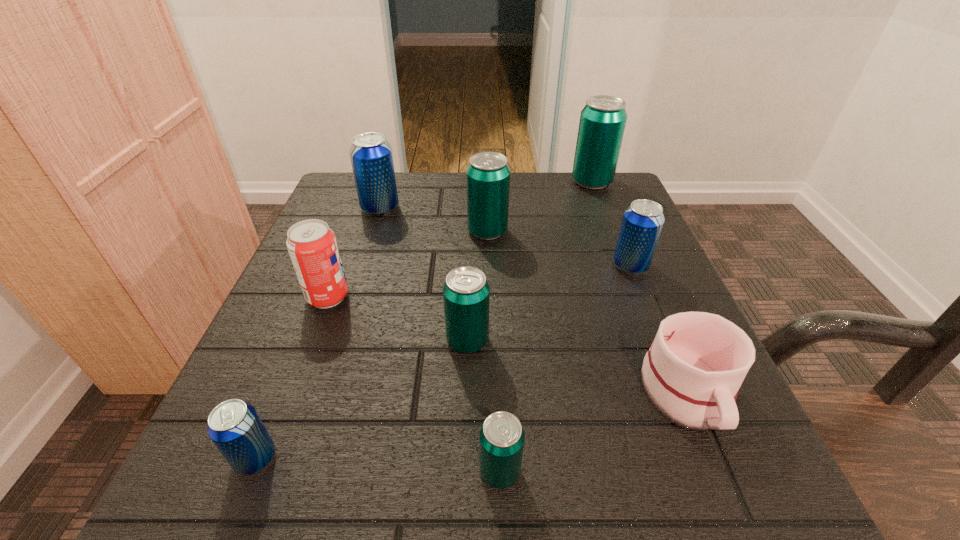
The image size is (960, 540). What are the coordinates of `the tallest object` in the screenshot? It's located at (602, 123).

This screenshot has width=960, height=540. I want to click on the tallest beer can, so click(602, 123).

The width and height of the screenshot is (960, 540). What are the coordinates of `the sixth nearest beer can` in the screenshot? It's located at (371, 157).

Find the location of a particular element. This screenshot has height=540, width=960. the biggest blue beer can is located at coordinates (371, 157).

You are a GUI agent. You are given a task and a screenshot of the screen. Output one action in this format:
    pyautogui.click(x=<x>, y=<y>)
    Task: Click on the third nearest teal beer can
    The width and height of the screenshot is (960, 540).
    Given the screenshot: What is the action you would take?
    pyautogui.click(x=488, y=175)

The width and height of the screenshot is (960, 540). What are the coordinates of `the fifth nearest beer can` in the screenshot? It's located at (488, 175).

Where is `the fifth nearest object`? Image resolution: width=960 pixels, height=540 pixels. the fifth nearest object is located at coordinates (312, 246).

You are a GUI agent. You are given a task and a screenshot of the screen. Output one action in this format:
    pyautogui.click(x=<x>, y=<y>)
    Task: Click on the rightmost blue beer can
    
    Given the screenshot: What is the action you would take?
    pyautogui.click(x=642, y=223)

This screenshot has width=960, height=540. Identify the location of the fourth farthest beer can. (642, 223).

This screenshot has height=540, width=960. In order to click on the third nearest beer can in this screenshot , I will do `click(466, 293)`.